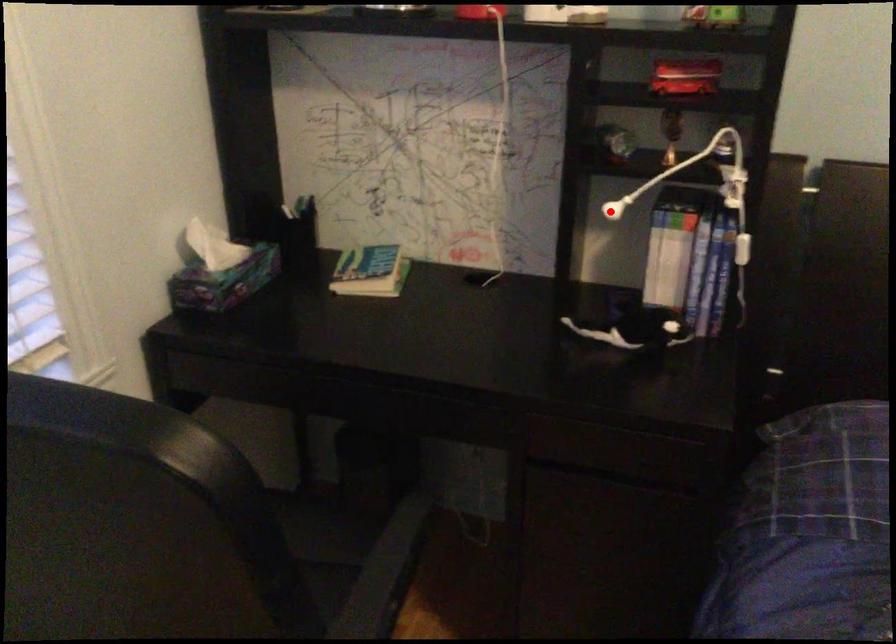
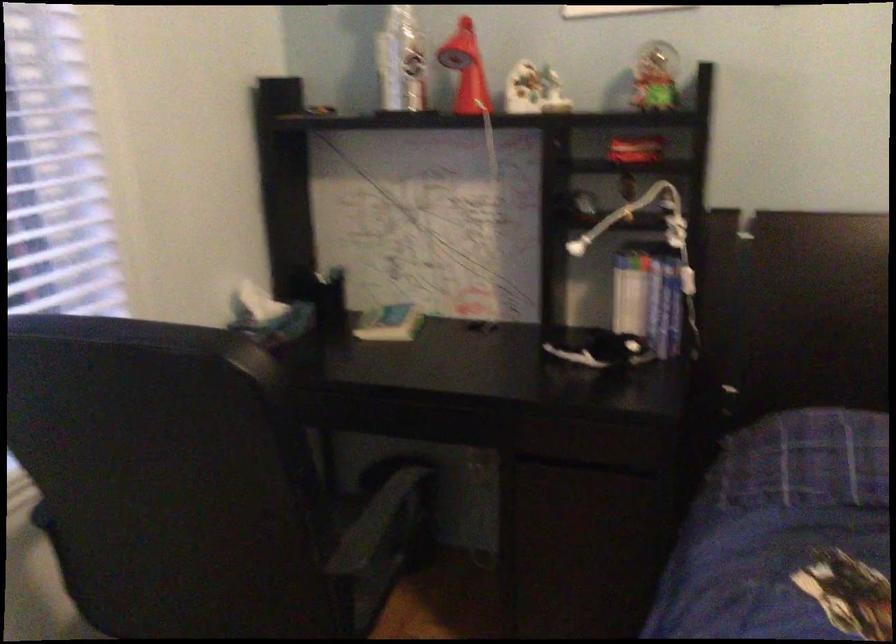
Find the pixel in the second image that matches the highlighted location in the first image.

(576, 247)